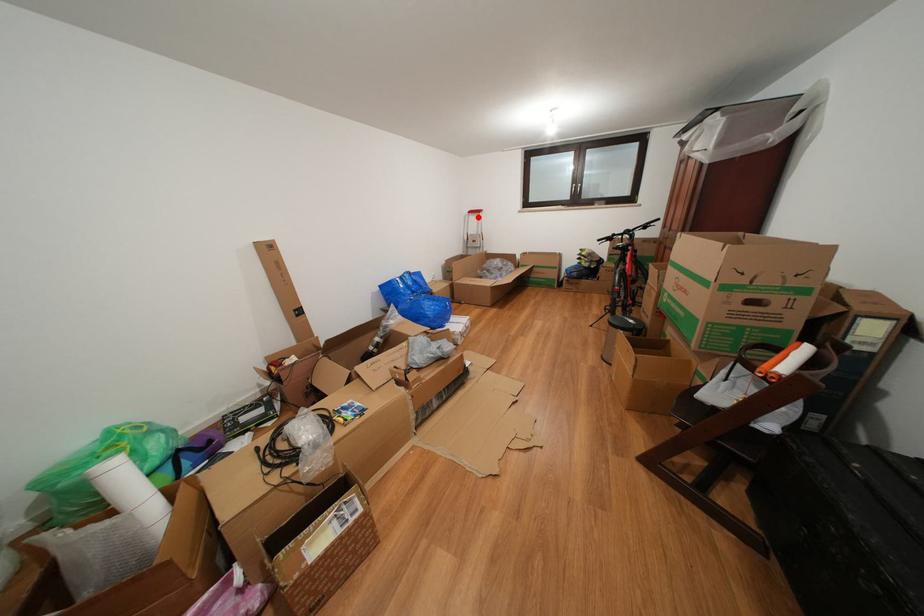
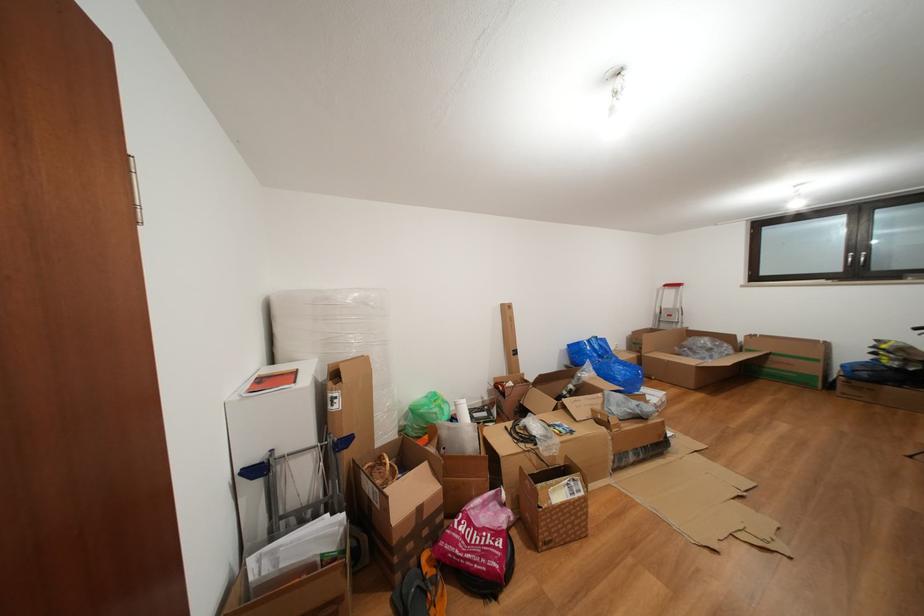
Question: A red point is marked in image1. In image2, is the corresponding 3D point closer to the camera or farther? Reply with the corresponding letter.

Choices:
 (A) The corresponding 3D point is closer.
 (B) The corresponding 3D point is farther.

Answer: (B)